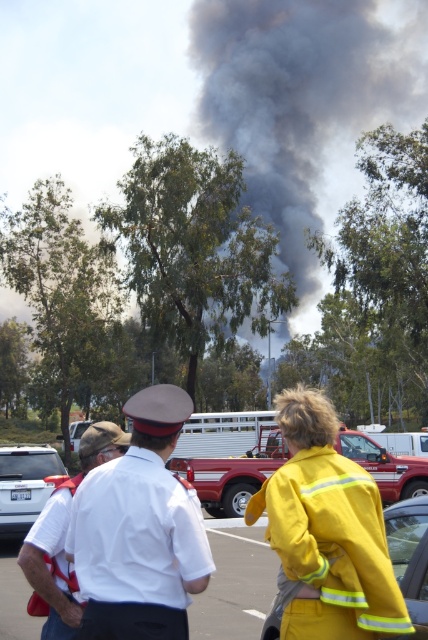
Between point (92, 634) and point (416, 614), which one is positioned in front?

Positioned in front is point (92, 634).

Between white uniform at center and yellow reflective jacket at lower right, which one appears on the right side from the viewer's perspective?

yellow reflective jacket at lower right is more to the right.

Which is in front, point (158, 476) or point (410, 634)?

Point (158, 476) is in front.

Identify the location of white uniform at center. The height and width of the screenshot is (640, 428). (139, 531).

Which is in front, point (166, 604) or point (213, 477)?

Point (166, 604) is in front.

Is the position of white uniform at center less distant than that of metallic red fire truck at center?

Yes, white uniform at center is closer to the viewer.

The width and height of the screenshot is (428, 640). What do you see at coordinates (139, 531) in the screenshot?
I see `white uniform at center` at bounding box center [139, 531].

In order to click on white uniform at center in this screenshot , I will do `click(139, 531)`.

Is yellow reflective uniform at center in front of white matte suv at lower left?

Yes, yellow reflective uniform at center is closer to the viewer.

Between yellow reflective uniform at center and white matte suv at lower left, which one is positioned higher?

white matte suv at lower left is above.

Is point (252, 604) positioned behind point (32, 452)?

That is False.

In order to click on yellow reflective uniform at center in this screenshot , I will do `click(235, 582)`.